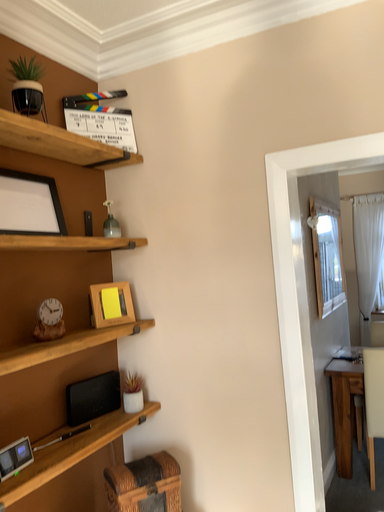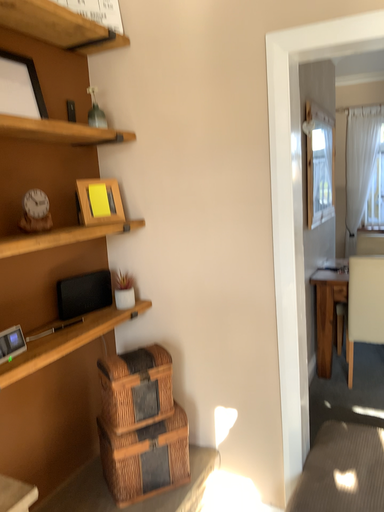
Question: How did the camera likely rotate when shooting the video?

Choices:
 (A) rotated upward
 (B) rotated downward

Answer: (B)